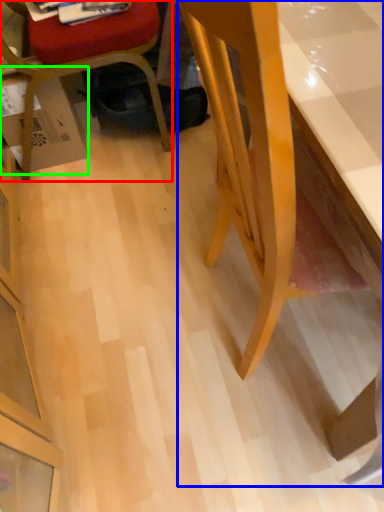
Question: Which object is the farthest from chair (highlighted by a red box)? Choose among these: desk (highlighted by a blue box) or cardboard box (highlighted by a green box).

Choices:
 (A) desk
 (B) cardboard box

Answer: (A)